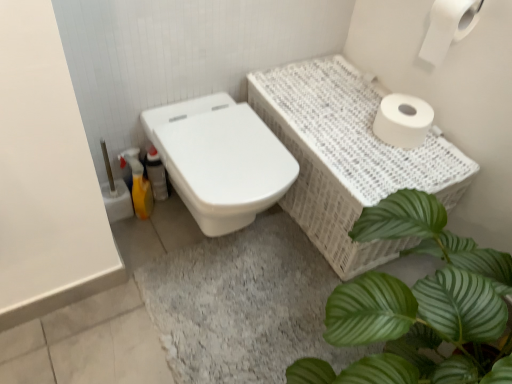
Identify the location of free space to the back side of white matte toilet paper at upper right, which appears as the first toilet paper when ordered from the bottom. The height and width of the screenshot is (384, 512). (366, 94).